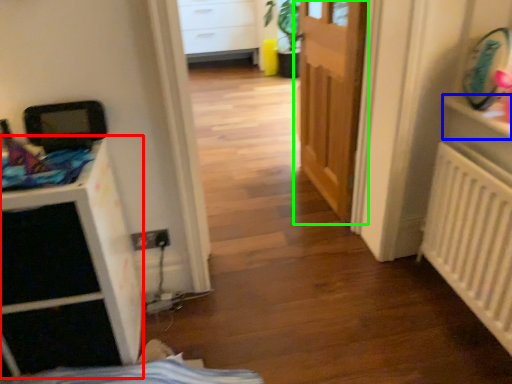
Question: Estimate the real-world distances between objects in this image. Which object is farther from file cabinet (highlighted by a red box), shelf (highlighted by a blue box) or door (highlighted by a green box)?

Choices:
 (A) shelf
 (B) door

Answer: (A)